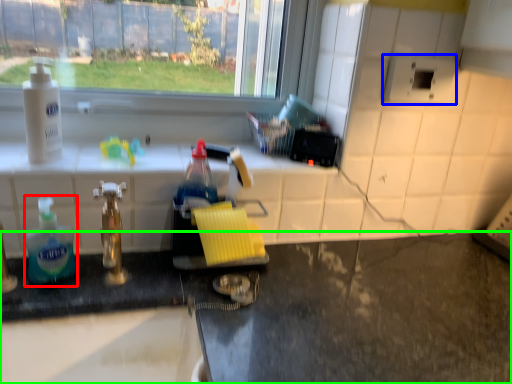
Question: Which is nearer to the bottle (highlighted by a red box)? appliance (highlighted by a blue box) or counter (highlighted by a green box).

Choices:
 (A) appliance
 (B) counter

Answer: (B)